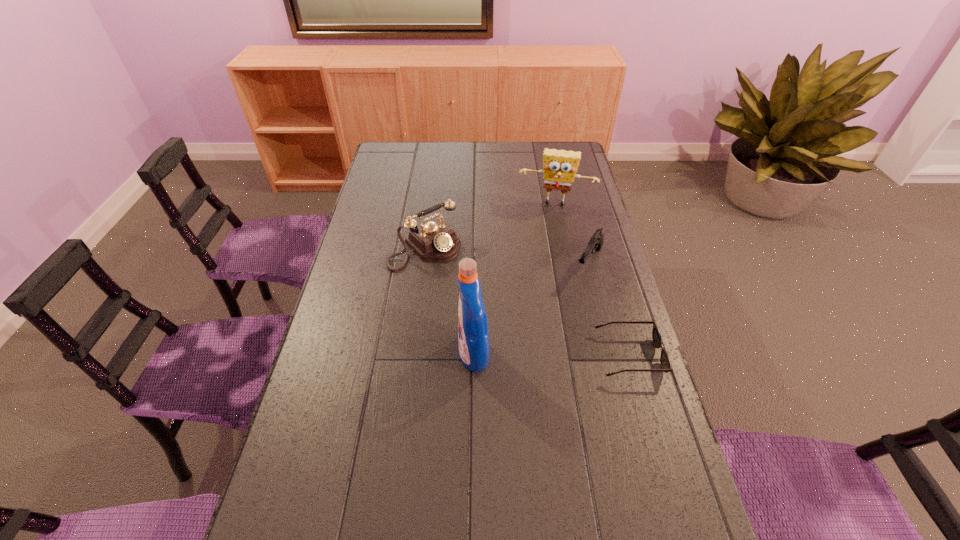
Locate an element on the screen. object that is at the left edge is located at coordinates (435, 241).

Where is `sunglasses at the right edge`? This screenshot has width=960, height=540. sunglasses at the right edge is located at coordinates (665, 361).

The height and width of the screenshot is (540, 960). I want to click on sponge at the right edge, so coord(560,166).

The height and width of the screenshot is (540, 960). Find the location of `gun at the right edge`. gun at the right edge is located at coordinates (596, 242).

This screenshot has height=540, width=960. I want to click on vacant space at the far edge, so click(x=457, y=165).

Locate an element on the screen. vacant region at the near edge is located at coordinates (468, 506).

At what (x,y) coordinates should I click in order to perform the action: click on vacant space at the left edge of the desktop. Please return your answer as a coordinate pair (x, y). The height and width of the screenshot is (540, 960). Looking at the image, I should click on (366, 198).

In the image, there is a desktop. Where is `vacant space at the right edge`? vacant space at the right edge is located at coordinates point(596,300).

Identify the location of vacant space at the far left corner. (381, 151).

In the image, there is a desktop. Identify the location of vacant space at the far right corner. (543, 149).